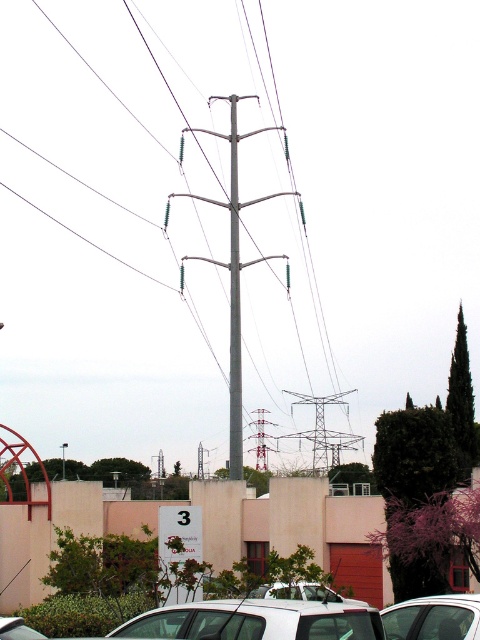
You are standing in front of the building with the red door and want to walk from the point at coordinate (250, 506) to the point at coordinate (450, 632). Which direction should you face to move towards the second point?

You should face away from the building with the red door because point (450, 632) is further away from you than point (250, 506).

You are standing in the urban setting shown in the image. You notice a point at coordinates [232,268]. Which object from the scene does this point correspond to?

The point at coordinates [232,268] corresponds to the metallic gray telegraph pole at center.

You are standing in front of the building with the red door and want to walk to the utility pole. Which point, point [278,636] or point [229,348], is closer to your current position?

Point [278,636] is closer to the viewer than point [229,348], so it is closer to your current position.